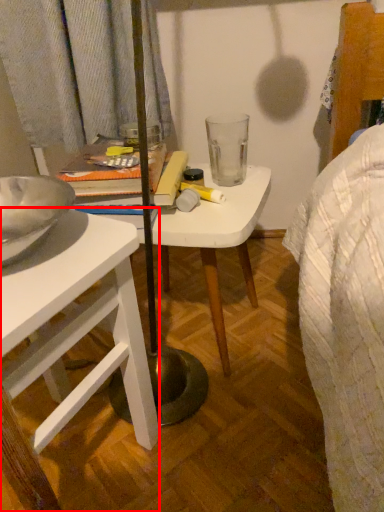
Question: Where is desk (annotated by the red box) located in relation to table in the image?

Choices:
 (A) right
 (B) left

Answer: (B)